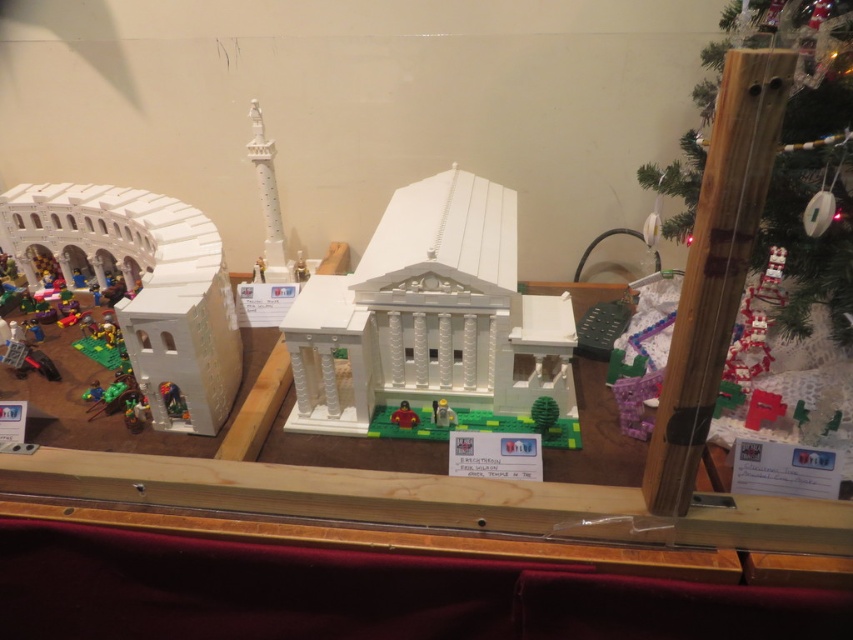
You are an architect visiting an exhibition and see the white matte lego building at center and the green matte christmas tree at center displayed in the same case. Which object takes up more space in the display case?

The white matte lego building at center has a larger size compared to the green matte christmas tree at center, so it takes up more space in the display case.

You are standing in front of the display case and want to locate the white matte LEGO building at center. According to the coordinates provided, where exactly is it positioned within the display?

The white matte LEGO building at center is precisely located at the coordinates point [428,316], which places it near the center of the display case.

You are a visitor at the display case and want to take a photo of the white matte lego building at center and the matte yellow toy at center. Which one will appear larger in your photo?

The white matte lego building at center will appear larger in your photo because it is in front of the matte yellow toy at center, making it closer to the camera.